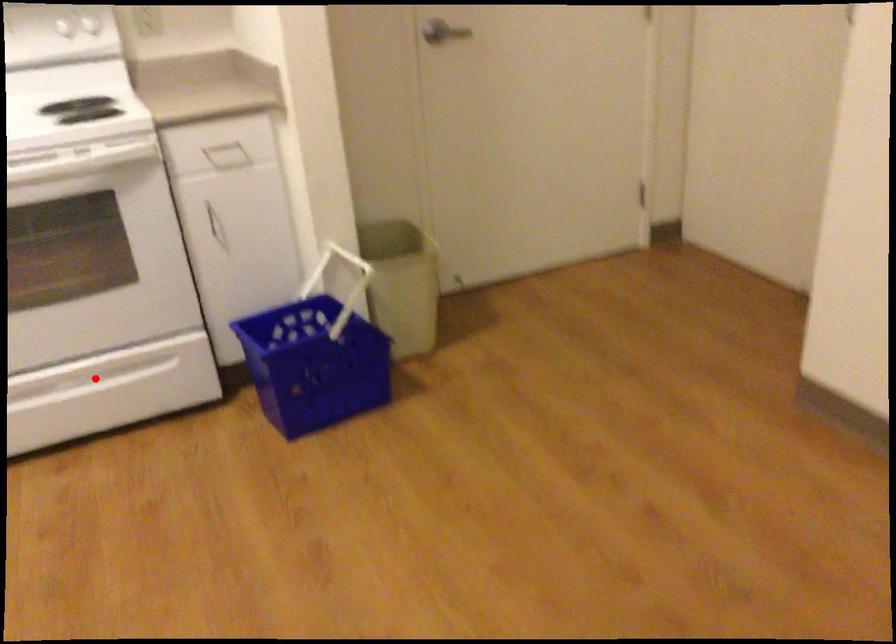
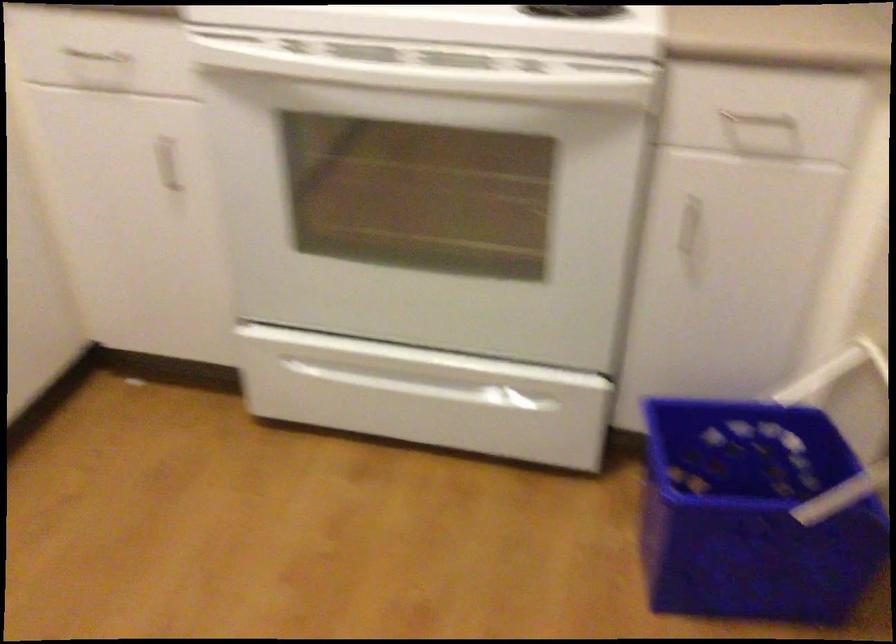
Question: I am providing you with two images of the same scene from different viewpoints. In image1, a red point is highlighted. Considering the same 3D point in image2, which of the following is correct?

Choices:
 (A) It is closer
 (B) It is farther

Answer: (A)